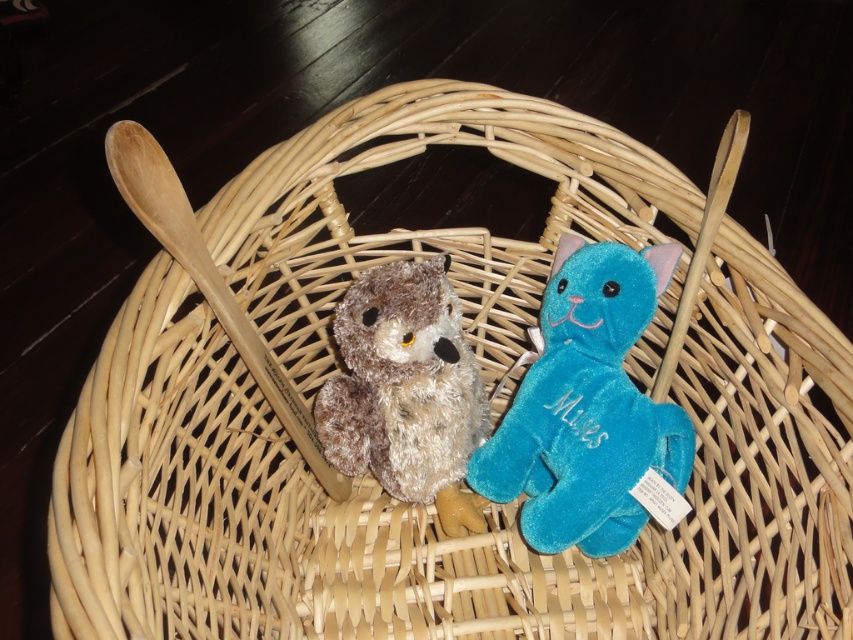
Is point (648, 401) positioned in front of point (389, 412)?

Yes.

Can you confirm if velvet blue cat at center is taller than fuzzy brown owl at center?

Indeed, velvet blue cat at center has a greater height compared to fuzzy brown owl at center.

Is point (664, 464) less distant than point (434, 355)?

No, it is not.

You are a GUI agent. You are given a task and a screenshot of the screen. Output one action in this format:
    pyautogui.click(x=<x>, y=<y>)
    Task: Click on the velvet blue cat at center
    This screenshot has width=853, height=640.
    Given the screenshot: What is the action you would take?
    pyautogui.click(x=590, y=410)